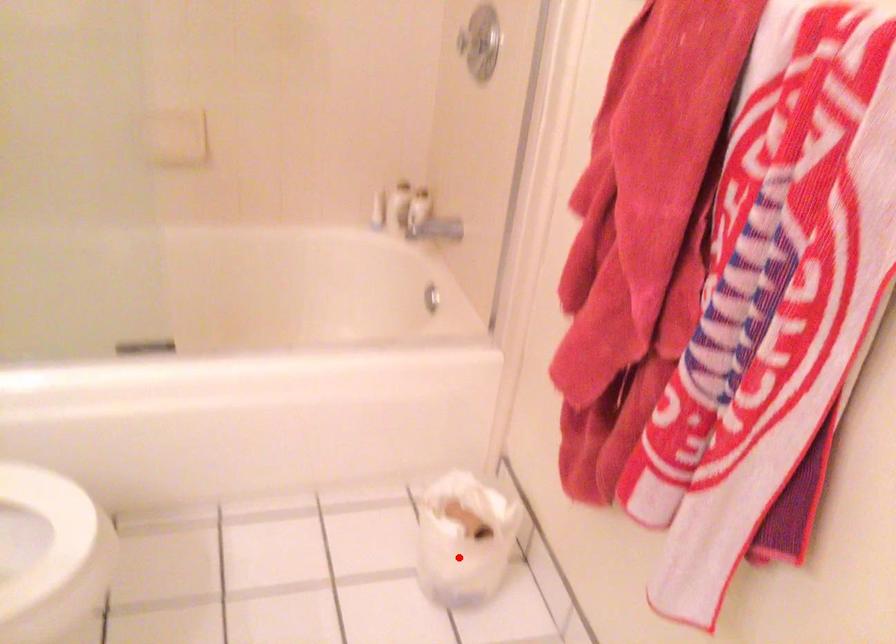
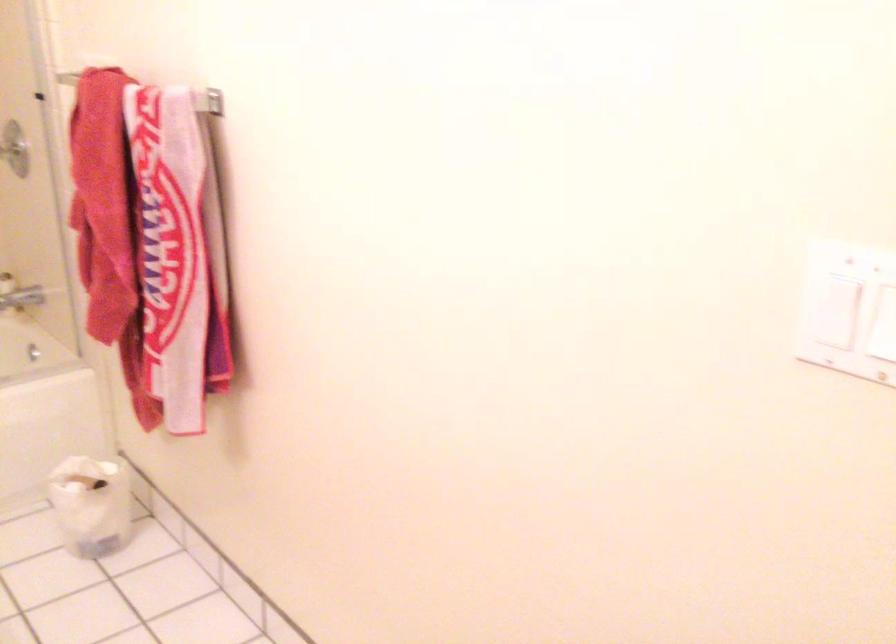
Question: I am providing you with two images of the same scene from different viewpoints. Given a red point in image1, look at the same physical point in image2. Is it:

Choices:
 (A) Closer to the viewpoint
 (B) Farther from the viewpoint

Answer: (B)